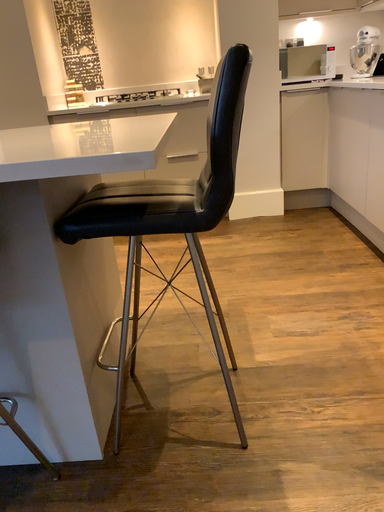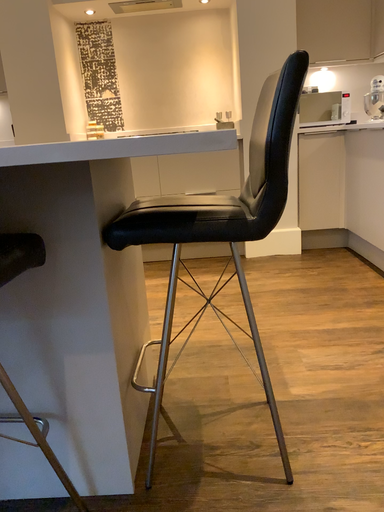
Question: How did the camera likely rotate when shooting the video?

Choices:
 (A) rotated downward
 (B) rotated upward

Answer: (B)